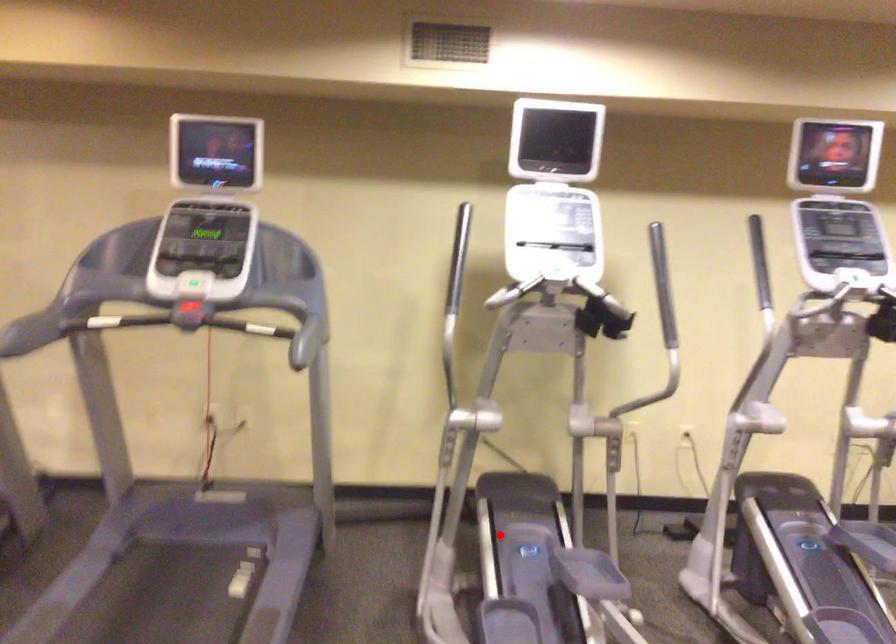
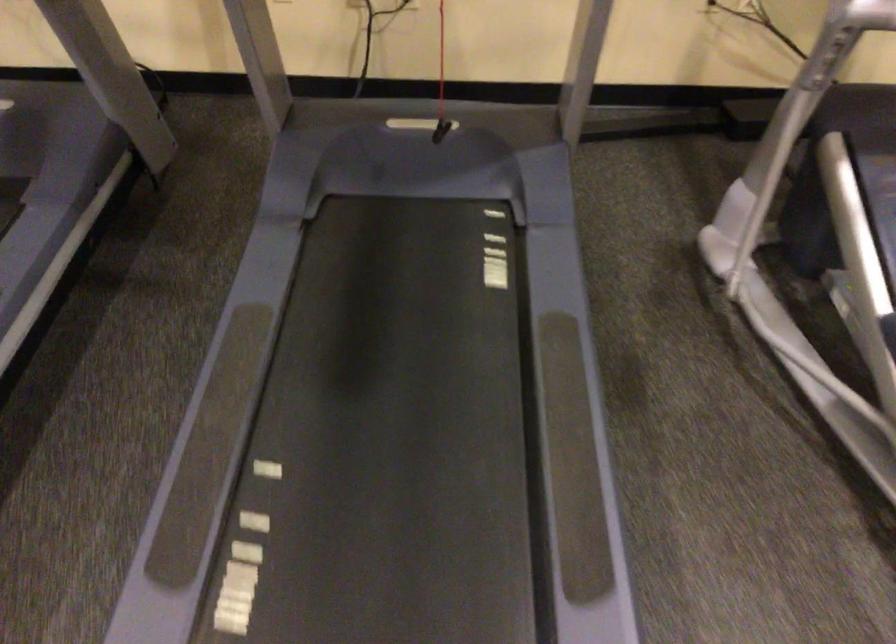
In the second image, find the point that corresponds to the highlighted location in the first image.

(876, 190)